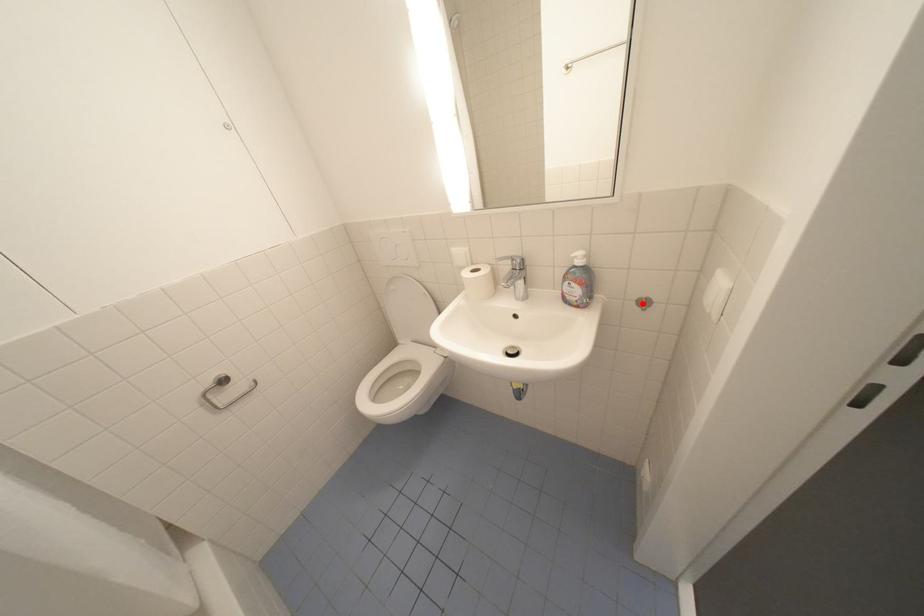
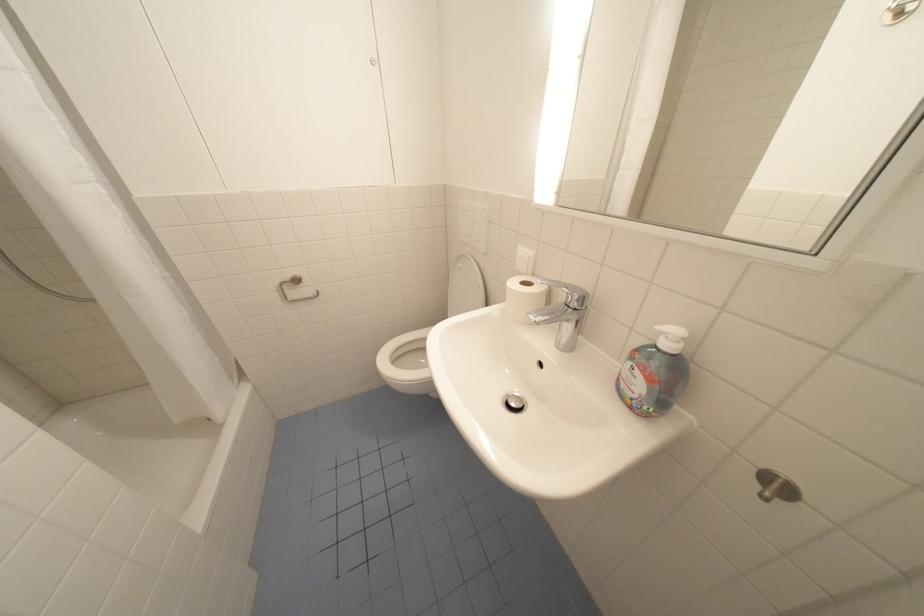
The point at the highlighted location is marked in the first image. Where is the corresponding point in the second image?

(763, 471)